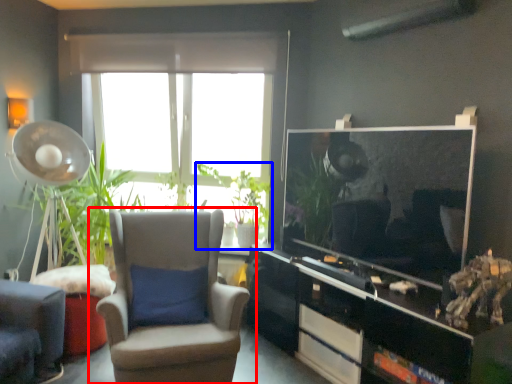
Question: Which point is further to the camera, chair (highlighted by a red box) or houseplant (highlighted by a blue box)?

Choices:
 (A) chair
 (B) houseplant

Answer: (B)